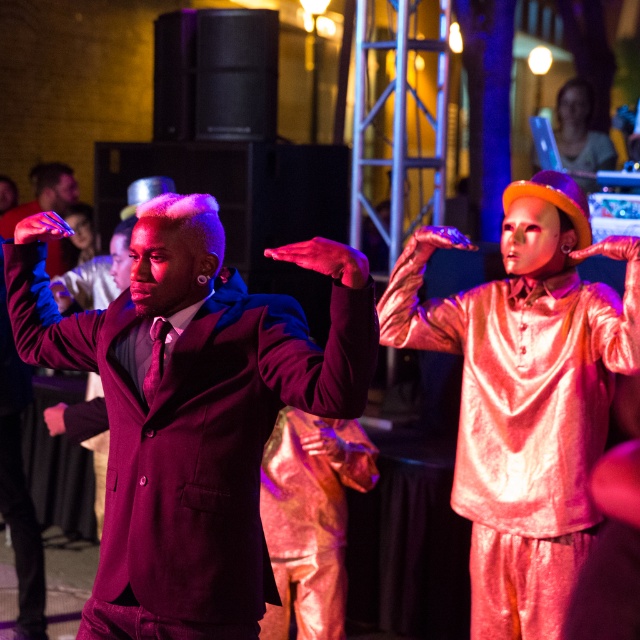
Question: Which object appears farthest from the camera in this image?

Choices:
 (A) smooth skin face at upper right
 (B) matte black suit at center

Answer: (A)

Question: Which point is farther from the camera taking this photo?

Choices:
 (A) (67, 182)
 (B) (563, 150)

Answer: (B)

Question: Does shiny purple suit at center appear on the left side of smooth skin face at upper right?

Choices:
 (A) yes
 (B) no

Answer: (A)

Question: Can you confirm if matte black suit at center is positioned above shiny purple suit at center?

Choices:
 (A) yes
 (B) no

Answer: (A)

Question: Among these objects, which one is nearest to the camera?

Choices:
 (A) smooth skin face at upper right
 (B) matte black suit at center

Answer: (B)

Question: Is shiny purple suit at center below smooth skin face at upper right?

Choices:
 (A) yes
 (B) no

Answer: (A)